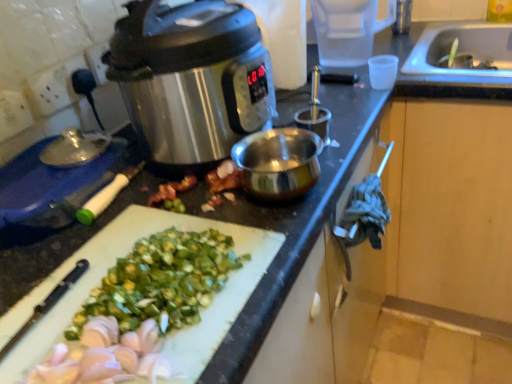
Question: Looking at the image, does white plastic cutting board at lower left seem bigger or smaller compared to transparent plastic cup at upper right?

Choices:
 (A) big
 (B) small

Answer: (B)

Question: Considering the relative positions of white plastic cutting board at lower left and transparent plastic cup at upper right in the image provided, is white plastic cutting board at lower left to the left or to the right of transparent plastic cup at upper right?

Choices:
 (A) left
 (B) right

Answer: (A)

Question: Estimate the real-world distances between objects in this image. Which object is closer to the stainless steel slow cooker at upper left?

Choices:
 (A) white plastic cutting board at lower left
 (B) transparent plastic cup at upper right

Answer: (A)

Question: Which object is the closest to the stainless steel slow cooker at upper left?

Choices:
 (A) transparent plastic cup at upper right
 (B) white plastic cutting board at lower left

Answer: (B)